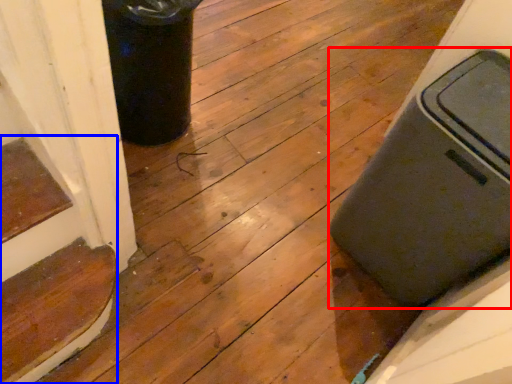
Question: Among these objects, which one is nearest to the camera, waste container (highlighted by a red box) or stairwell (highlighted by a blue box)?

Choices:
 (A) waste container
 (B) stairwell

Answer: (A)